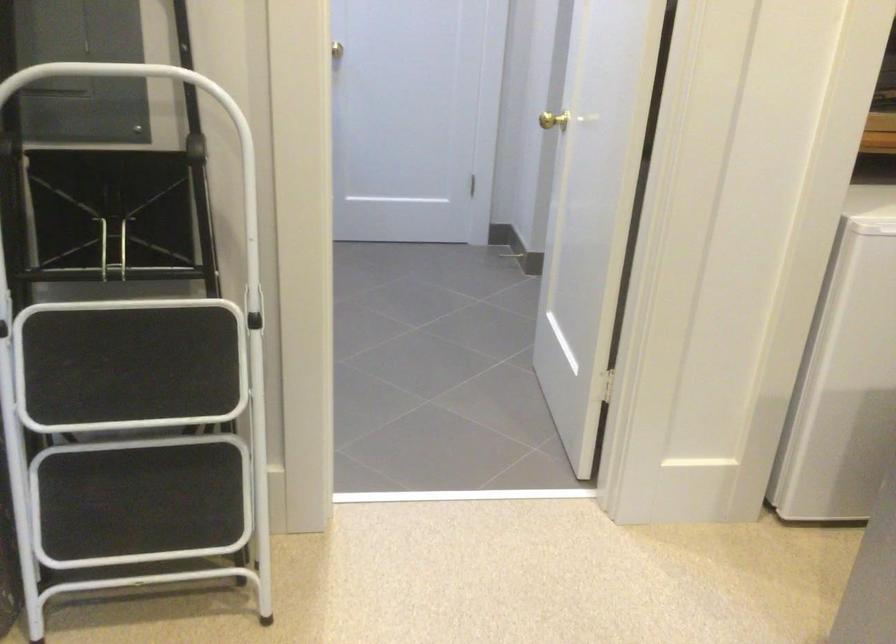
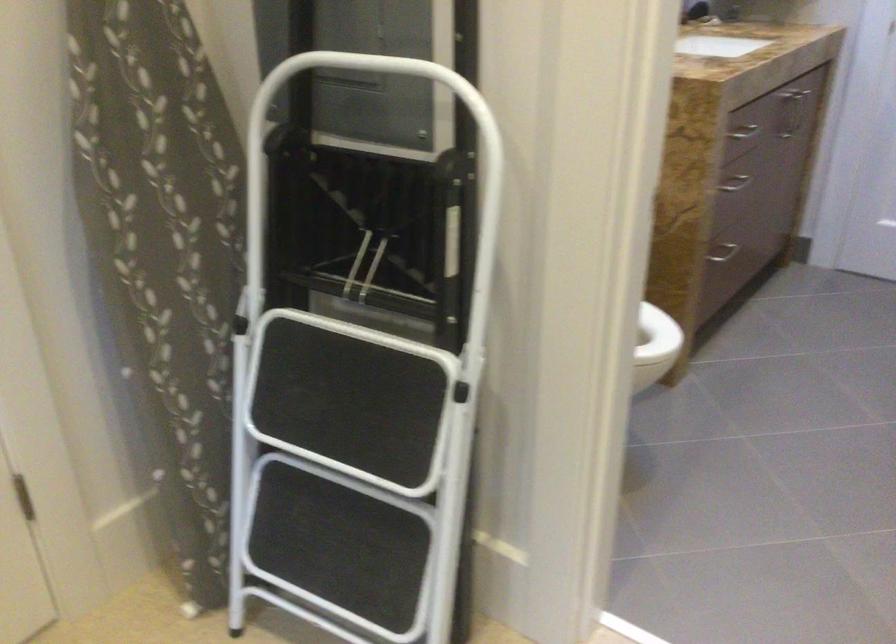
Question: Based on the continuous images, in which direction is the camera rotating? Reply with the corresponding letter.

Choices:
 (A) Left
 (B) Right
 (C) Up
 (D) Down

Answer: (A)